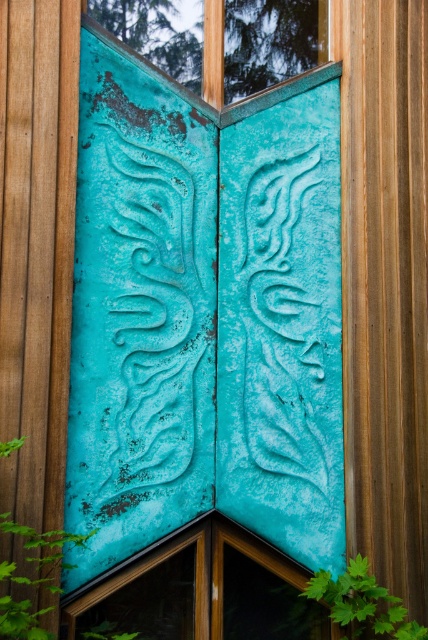
Can you confirm if aqua patina door at center is positioned to the left of teal patina glass at upper center?

Yes, aqua patina door at center is to the left of teal patina glass at upper center.

The height and width of the screenshot is (640, 428). I want to click on aqua patina door at center, so click(204, 592).

This screenshot has height=640, width=428. Find the location of `aqua patina door at center`. aqua patina door at center is located at coordinates (204, 592).